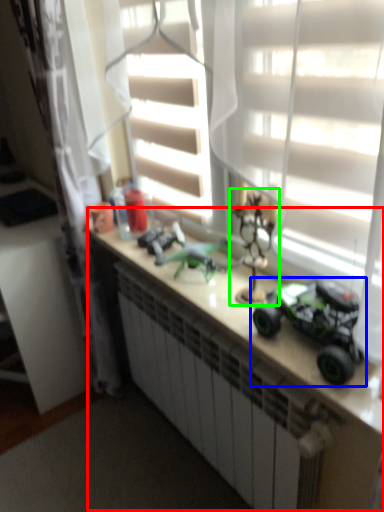
Question: Based on their relative distances, which object is nearer to counter (highlighted by a red box)? Choose from toy (highlighted by a blue box) and toy (highlighted by a green box).

Choices:
 (A) toy
 (B) toy

Answer: (A)